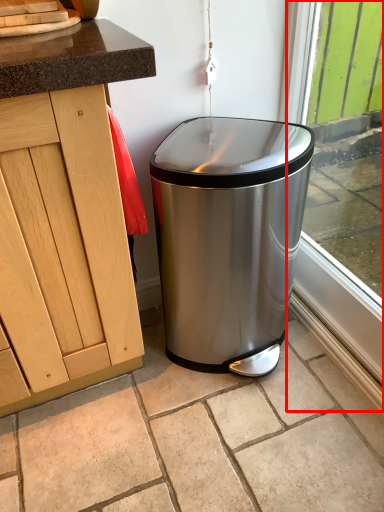
Question: From the image's perspective, considering the relative positions of window frame (annotated by the red box) and waste container in the image provided, where is window frame (annotated by the red box) located with respect to the staircase?

Choices:
 (A) above
 (B) below

Answer: (A)